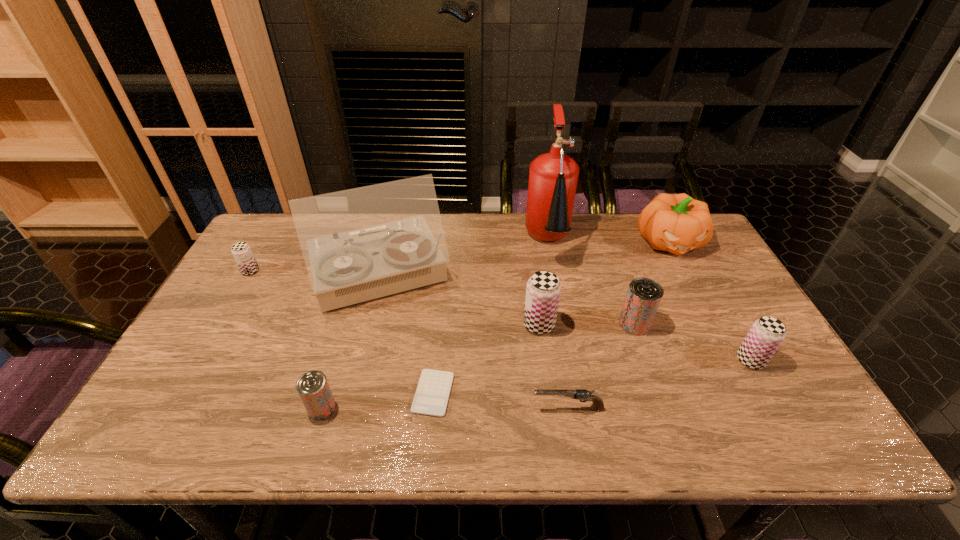
Find the location of a particular element. The image size is (960, 540). the farther red beer can is located at coordinates (644, 295).

Locate an element on the screen. the farthest purple beer can is located at coordinates (241, 251).

Identify the location of the smallest purple beer can. The height and width of the screenshot is (540, 960). (241, 251).

At what (x,y) coordinates should I click in order to perform the action: click on the nearest beer can. Please return your answer as a coordinate pair (x, y). This screenshot has width=960, height=540. Looking at the image, I should click on (314, 391).

Locate an element on the screen. The height and width of the screenshot is (540, 960). the second beer can from left to right is located at coordinates (314, 391).

Image resolution: width=960 pixels, height=540 pixels. What are the coordinates of `the ninth tallest object` in the screenshot? It's located at (579, 394).

Locate an element on the screen. The width and height of the screenshot is (960, 540). calculator is located at coordinates (431, 398).

Where is `the shortest object`? the shortest object is located at coordinates (431, 398).

The height and width of the screenshot is (540, 960). Find the location of `vacant area situated with the nozzle aimed from the red fire extinguisher`. vacant area situated with the nozzle aimed from the red fire extinguisher is located at coordinates (575, 381).

Identify the location of free space located 0.230m on the right of the second tallest object. (528, 275).